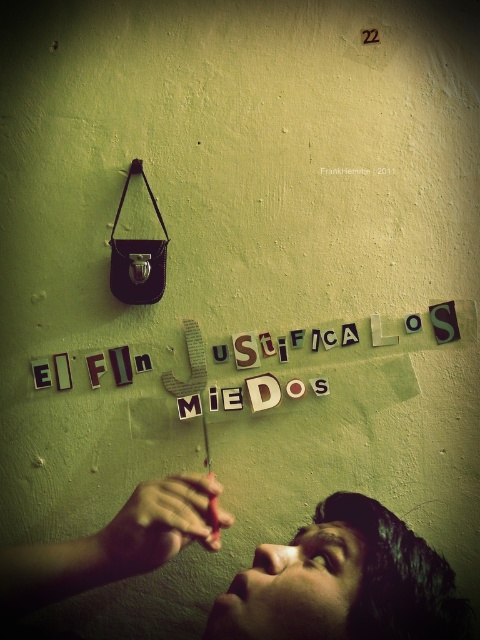
Question: Which object appears closest to the camera in this image?

Choices:
 (A) smooth skin hand at lower center
 (B) wooden letters at center

Answer: (A)

Question: Is smooth skin face at lower center below wooden letters at center?

Choices:
 (A) no
 (B) yes

Answer: (B)

Question: Does smooth skin face at lower center come in front of smooth skin hand at lower center?

Choices:
 (A) yes
 (B) no

Answer: (A)

Question: Which of the following is the farthest from the observer?

Choices:
 (A) wooden letters at center
 (B) smooth skin hand at lower center

Answer: (A)

Question: Which point is farther from the camera taking this photo?

Choices:
 (A) (168, 556)
 (B) (123, 349)

Answer: (B)

Question: Can you confirm if smooth skin face at lower center is thinner than smooth skin hand at lower center?

Choices:
 (A) yes
 (B) no

Answer: (B)